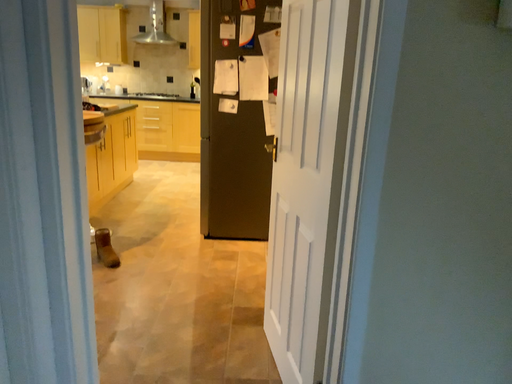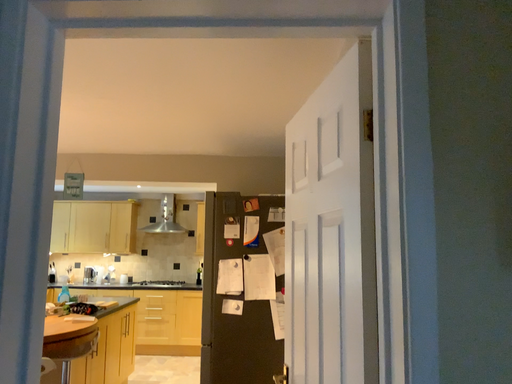
Question: How did the camera likely rotate when shooting the video?

Choices:
 (A) rotated upward
 (B) rotated downward

Answer: (A)